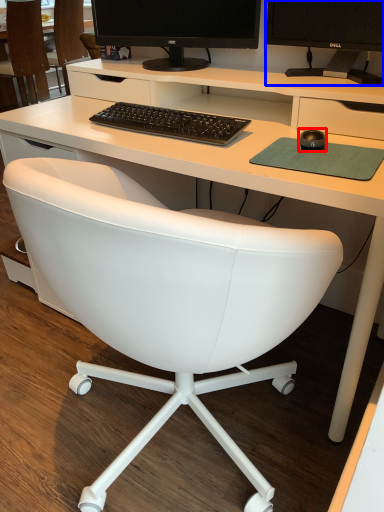
Question: Which object is closer to the camera taking this photo, mouse (highlighted by a red box) or television (highlighted by a blue box)?

Choices:
 (A) mouse
 (B) television

Answer: (A)